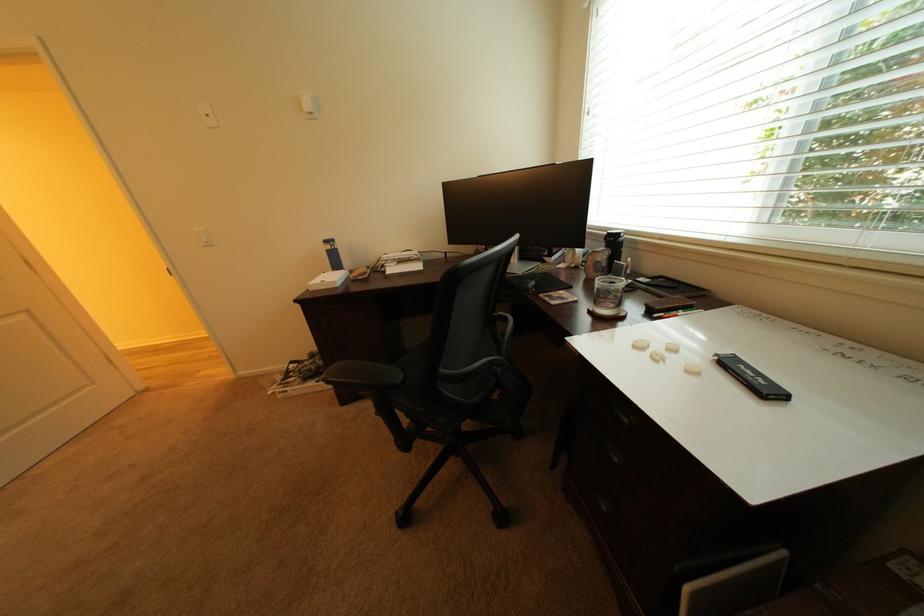
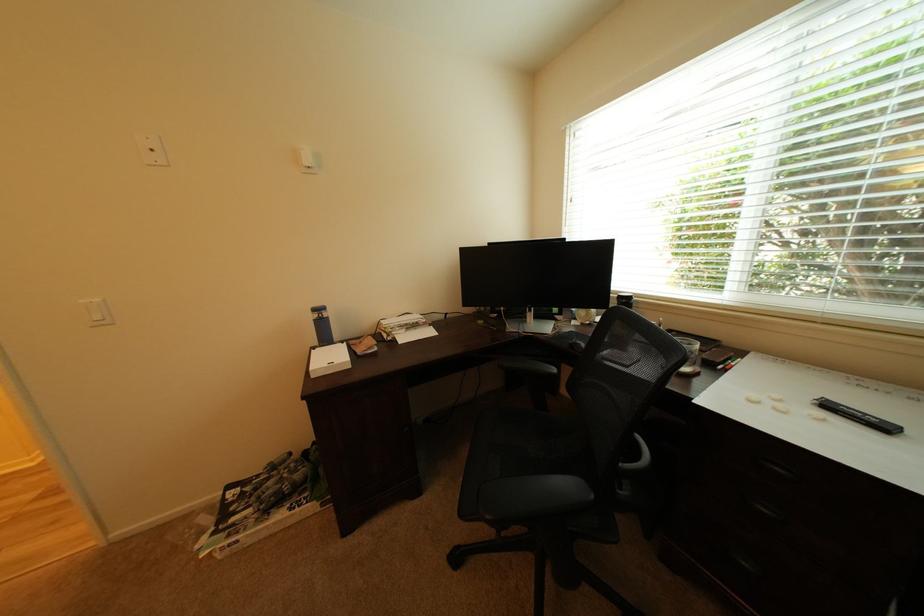
Locate, in the second image, the point that corresponds to point (338, 252) in the first image.

(324, 322)